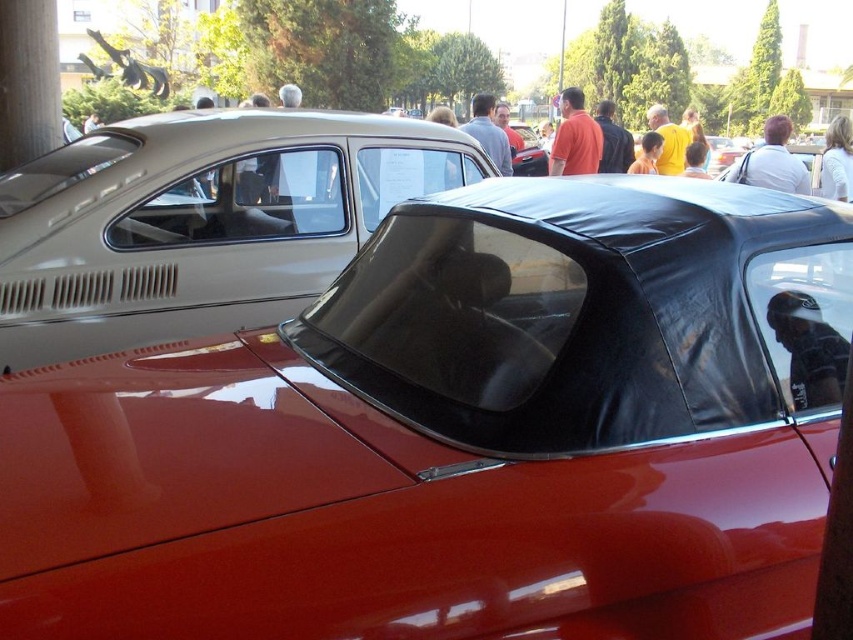
You are standing in front of two vintage cars at an exhibition. There are two points marked on the cars, point (564, 131) and point (672, 134). Which point is closer to you?

Point (564, 131) is closer to the viewer than point (672, 134).